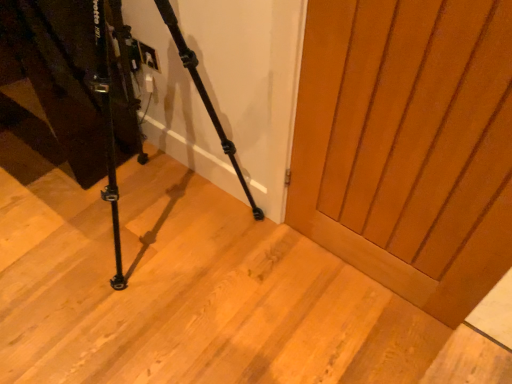
Image resolution: width=512 pixels, height=384 pixels. Identify the location of free space below black matte tripod at lower left (from a real-world perspective). (161, 232).